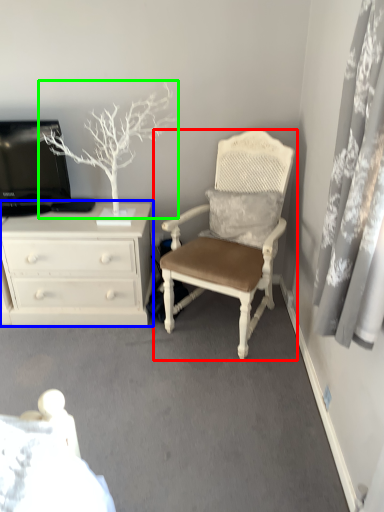
Question: Considering the real-world distances, which object is farthest from chair (highlighted by a red box)? chest of drawers (highlighted by a blue box) or tree (highlighted by a green box)?

Choices:
 (A) chest of drawers
 (B) tree

Answer: (B)